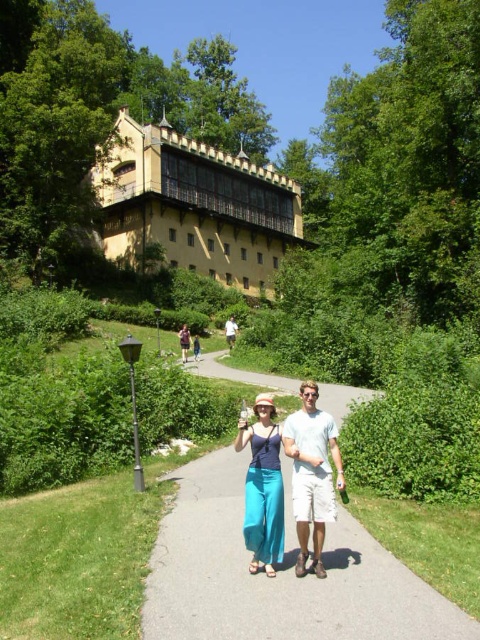
The height and width of the screenshot is (640, 480). Find the location of `white cotton shorts at center`. white cotton shorts at center is located at coordinates (312, 474).

Consider the image. Between gray concrete pavement at center and white cotton shorts at center, which one is positioned lower?

gray concrete pavement at center is lower down.

Between point (169, 561) and point (294, 500), which one is positioned behind?

The point (169, 561) is behind.

What do you see at coordinates (277, 573) in the screenshot? The height and width of the screenshot is (640, 480). I see `gray concrete pavement at center` at bounding box center [277, 573].

You are a GUI agent. You are given a task and a screenshot of the screen. Output one action in this format:
    pyautogui.click(x=<x>, y=<y>)
    Task: Click on the gray concrete pavement at center
    
    Given the screenshot: What is the action you would take?
    pyautogui.click(x=277, y=573)

Can you confirm if yellow matte building at upper center is positioned above white cotton shorts at center?

Correct, yellow matte building at upper center is located above white cotton shorts at center.

Who is positioned more to the right, yellow matte building at upper center or white cotton shorts at center?

white cotton shorts at center is more to the right.

Is point (230, 172) farther from camera compared to point (294, 417)?

That is True.

The image size is (480, 640). Find the location of `yellow matte building at upper center`. yellow matte building at upper center is located at coordinates (193, 205).